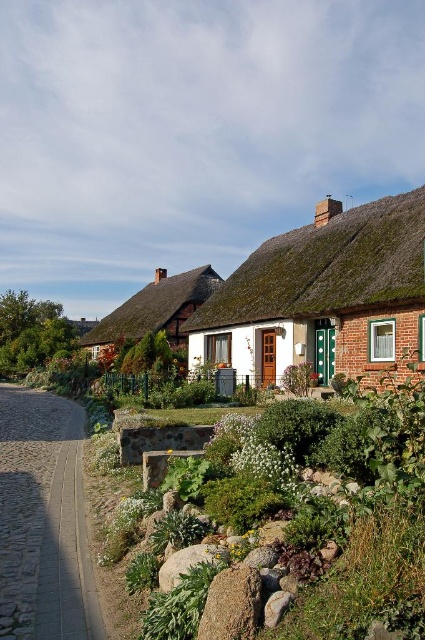
The height and width of the screenshot is (640, 425). Describe the element at coordinates (336, 506) in the screenshot. I see `green stone bench at center` at that location.

Image resolution: width=425 pixels, height=640 pixels. Find the location of `green stone bench at center`. green stone bench at center is located at coordinates (336, 506).

Does paved stone path at lower left have a lesser height compared to thatched roof at upper center?

Yes.

Which is behind, point (28, 515) or point (391, 304)?

Positioned behind is point (391, 304).

At what (x,y) coordinates should I click in order to perform the action: click on paved stone path at lower left. Please return your answer as a coordinate pair (x, y). This screenshot has height=640, width=425. Looking at the image, I should click on (44, 520).

Is paved stone path at lower left to the right of thatched roof cottage at center from the viewer's perspective?

Indeed, paved stone path at lower left is positioned on the right side of thatched roof cottage at center.

Does paved stone path at lower left come behind thatched roof cottage at center?

No, it is in front of thatched roof cottage at center.

Which is behind, point (14, 387) or point (124, 317)?

Point (124, 317)

Identify the location of paved stone path at lower left. (44, 520).